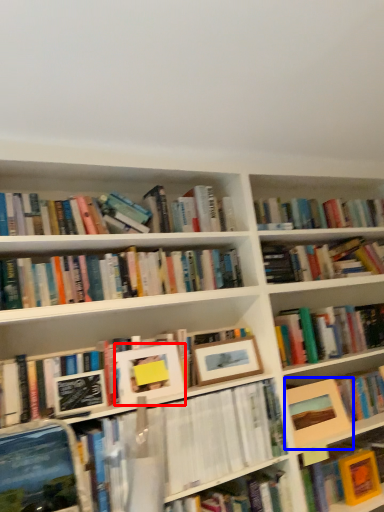
Question: Which object appears closest to the camera in this image, picture frame (highlighted by a red box) or picture frame (highlighted by a blue box)?

Choices:
 (A) picture frame
 (B) picture frame

Answer: (A)